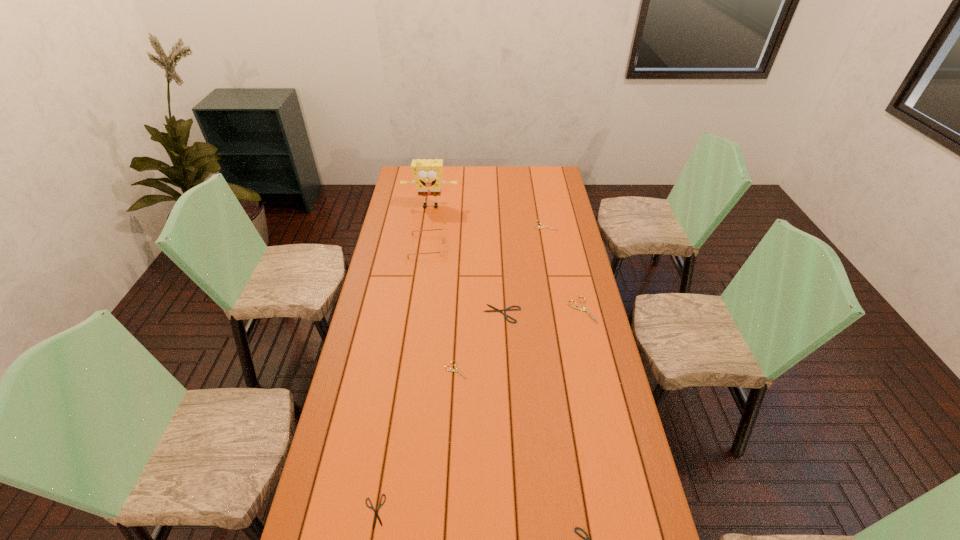
Find the location of a particular element. The image size is (960, 540). the second closest beige shears relative to the farthest beige shears is located at coordinates (452, 370).

This screenshot has width=960, height=540. Find the location of `black shears object that ranks as the second closest to the farthest shears`. black shears object that ranks as the second closest to the farthest shears is located at coordinates (587, 539).

Choose which black shears is the second nearest neighbor to the leftmost black shears. Please provide its 2D coordinates. Your answer should be formatted as a tuple, i.e. [(x, y)], where the tuple contains the x and y coordinates of a point satisfying the conditions above.

[(507, 309)]

Where is `vacant region that satisfies the following two spatial constraints: 1. on the front-facing side of the third nearest object; 2. on the left side of the sponge`? vacant region that satisfies the following two spatial constraints: 1. on the front-facing side of the third nearest object; 2. on the left side of the sponge is located at coordinates (407, 370).

Image resolution: width=960 pixels, height=540 pixels. Identify the location of free spot that satisfies the following two spatial constraints: 1. on the front-facing side of the tallest object; 2. on the left side of the tallest shears. (416, 310).

Locate an element on the screen. free space in the image that satisfies the following two spatial constraints: 1. on the front-facing side of the sixth shortest object; 2. on the right side of the farthest object is located at coordinates (416, 310).

Find the location of a particular element. free space that satisfies the following two spatial constraints: 1. on the front-facing side of the spectacles; 2. on the left side of the leftmost beige shears is located at coordinates (410, 370).